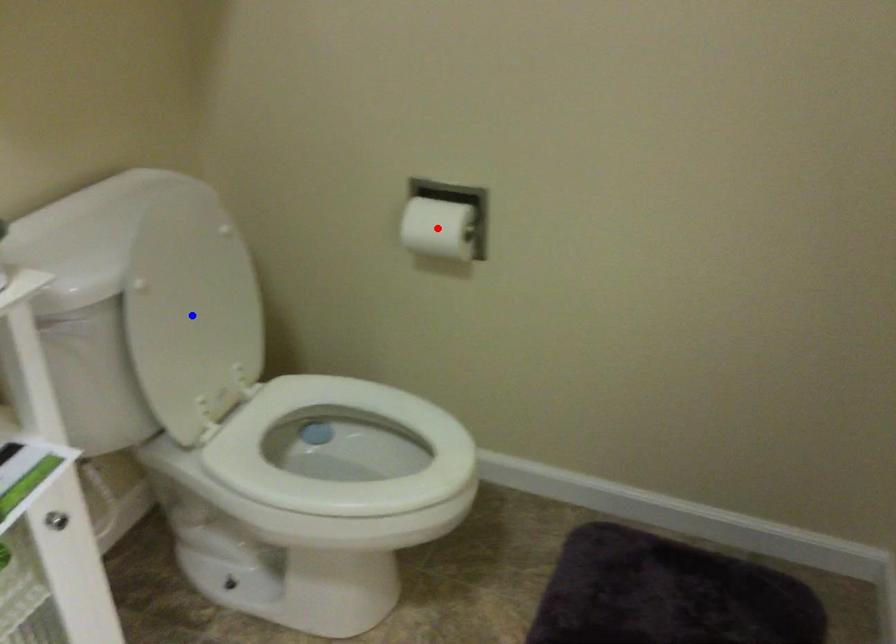
Question: In the image, two points are highlighted. Which point is nearer to the camera? Reply with the corresponding letter.

Choices:
 (A) blue point
 (B) red point

Answer: (A)